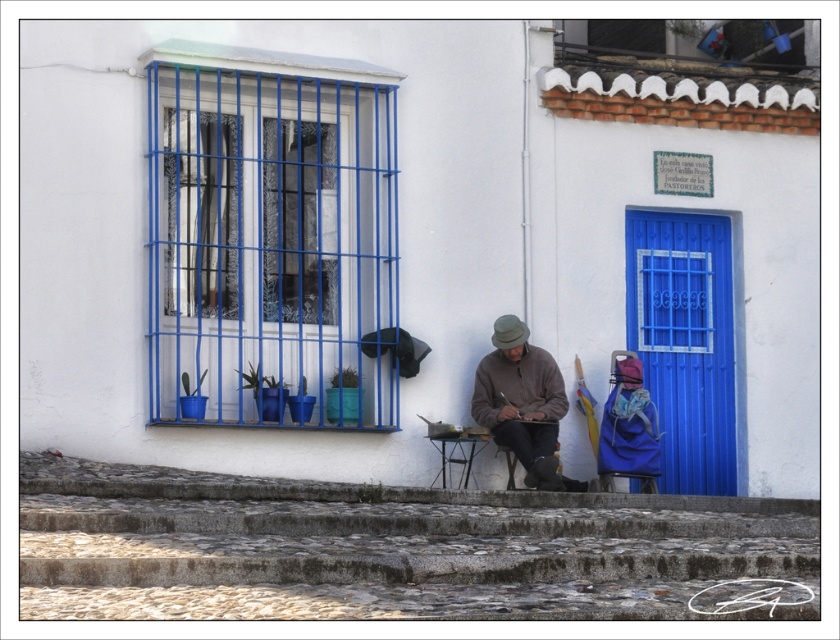
Can you confirm if blue painted wood door at right is bigger than wooden chair at lower center?

Yes.

Between blue painted wood door at right and wooden chair at lower center, which one is positioned lower?

wooden chair at lower center is below.

Does point (651, 374) lie behind point (544, 461)?

That is True.

At what (x,y) coordinates should I click in order to perform the action: click on blue painted wood door at right. Please return your answer as a coordinate pair (x, y). Image resolution: width=840 pixels, height=640 pixels. Looking at the image, I should click on (684, 342).

Which is below, blue metal bars at upper left or wooden chair at lower center?

wooden chair at lower center is below.

Between blue metal bars at upper left and wooden chair at lower center, which one appears on the right side from the viewer's perspective?

wooden chair at lower center

Does point (292, 164) lie behind point (525, 422)?

That is True.

Identify the location of blue metal bars at upper left. (270, 240).

This screenshot has height=640, width=840. Identify the location of blue metal bars at upper left. (270, 240).

Does point (323, 420) come farther from viewer compared to point (686, 484)?

No.

Locate an element on the screen. This screenshot has width=840, height=640. blue metal bars at upper left is located at coordinates (270, 240).